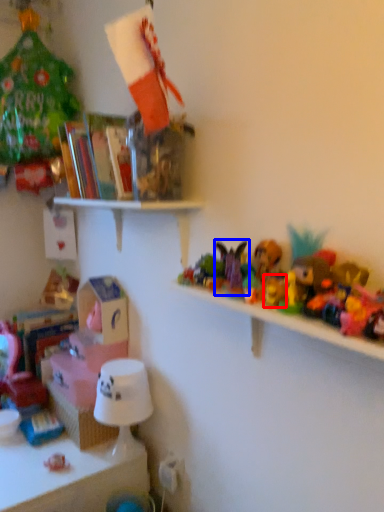
Question: Among these objects, which one is nearest to the camera, toy (highlighted by a red box) or toy (highlighted by a blue box)?

Choices:
 (A) toy
 (B) toy

Answer: (A)